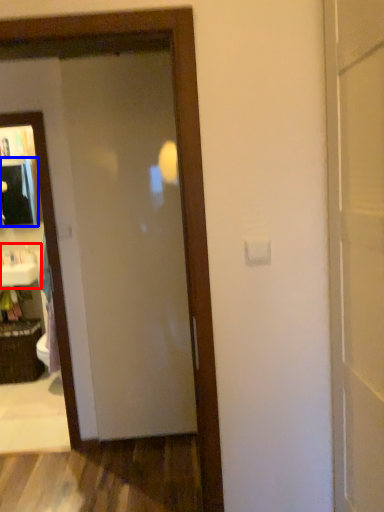
Question: Which object is closer to the camera taking this photo, sink (highlighted by a red box) or medicine cabinet (highlighted by a blue box)?

Choices:
 (A) sink
 (B) medicine cabinet

Answer: (A)